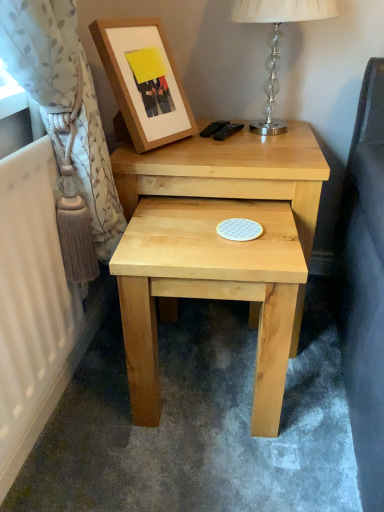
Where is `empty space that is ontop of natural wood nightstand at center`? empty space that is ontop of natural wood nightstand at center is located at coordinates (237, 141).